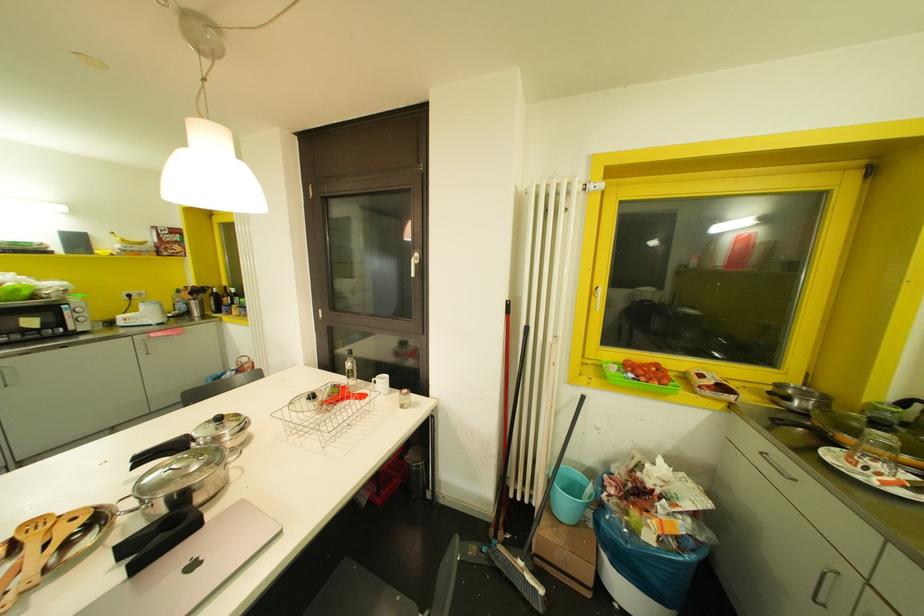
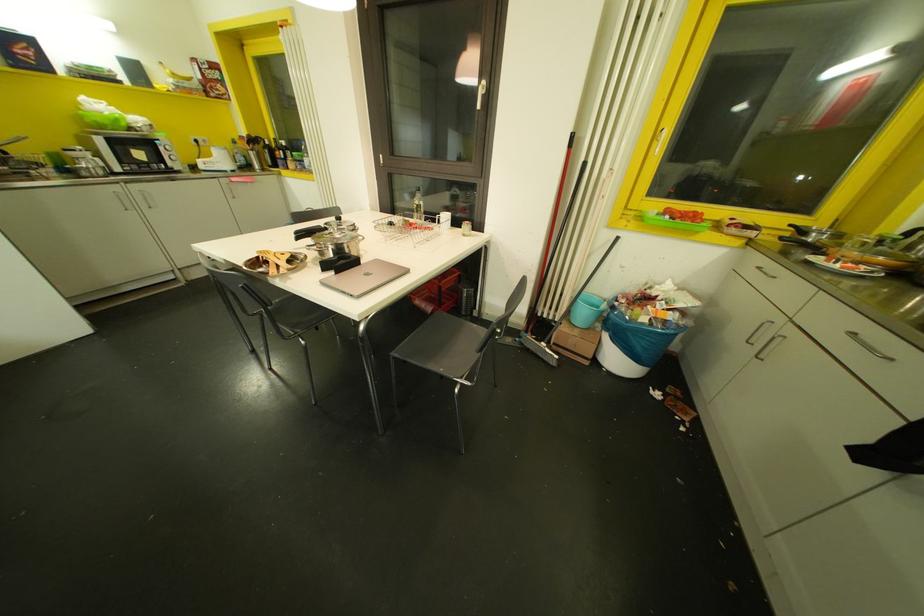
Where in the second image is the point corresponding to the point at 604,493 from the first image?

(614, 302)